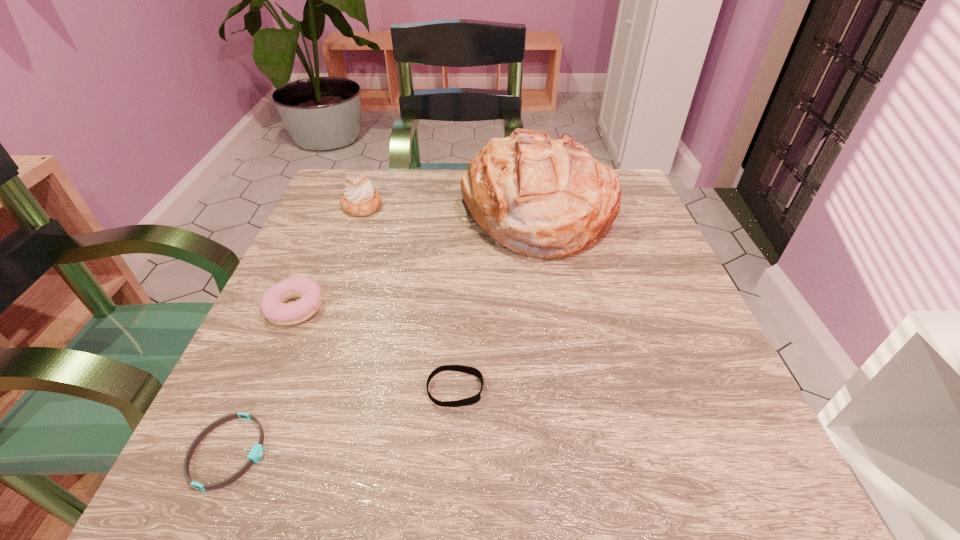
The width and height of the screenshot is (960, 540). In order to click on object at the far left corner in this screenshot , I will do `click(360, 199)`.

Locate an element on the screen. object that is positioned at the near left corner is located at coordinates (255, 454).

This screenshot has width=960, height=540. I want to click on object that is at the far right corner, so [540, 197].

In the image, there is a desktop. Identify the location of vacant space at the far edge. The height and width of the screenshot is (540, 960). (396, 199).

Image resolution: width=960 pixels, height=540 pixels. Identify the location of blank space at the near edge of the desktop. (543, 459).

This screenshot has height=540, width=960. Identify the location of vacant region at the left edge of the desktop. (306, 228).

I want to click on free region at the right edge, so click(x=720, y=401).

This screenshot has width=960, height=540. I want to click on vacant region at the far left corner of the desktop, so click(x=377, y=170).

The width and height of the screenshot is (960, 540). In the image, there is a desktop. What are the coordinates of `vacant area at the near right corner` in the screenshot? It's located at 766,477.

Image resolution: width=960 pixels, height=540 pixels. I want to click on free space between the third tallest object and the tallest object, so click(416, 261).